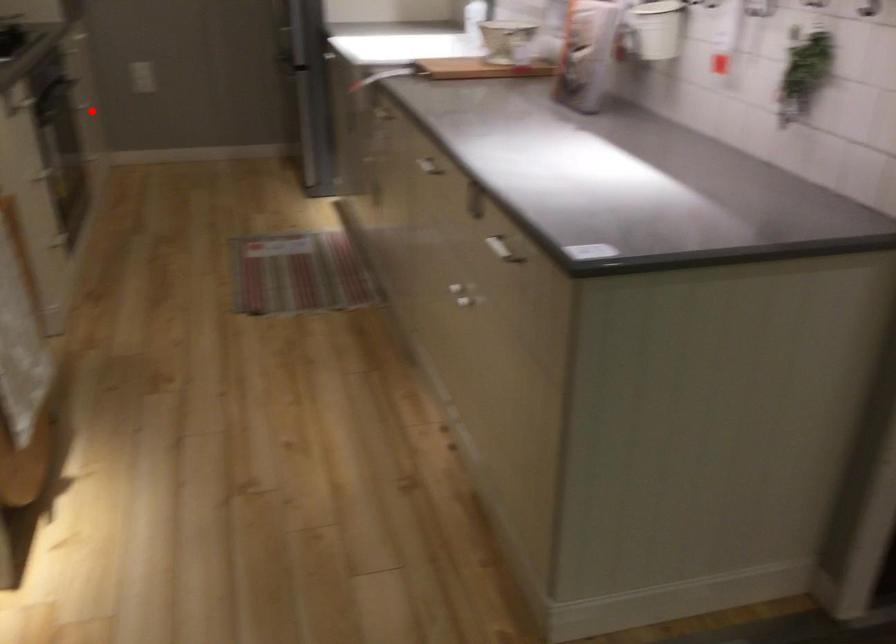
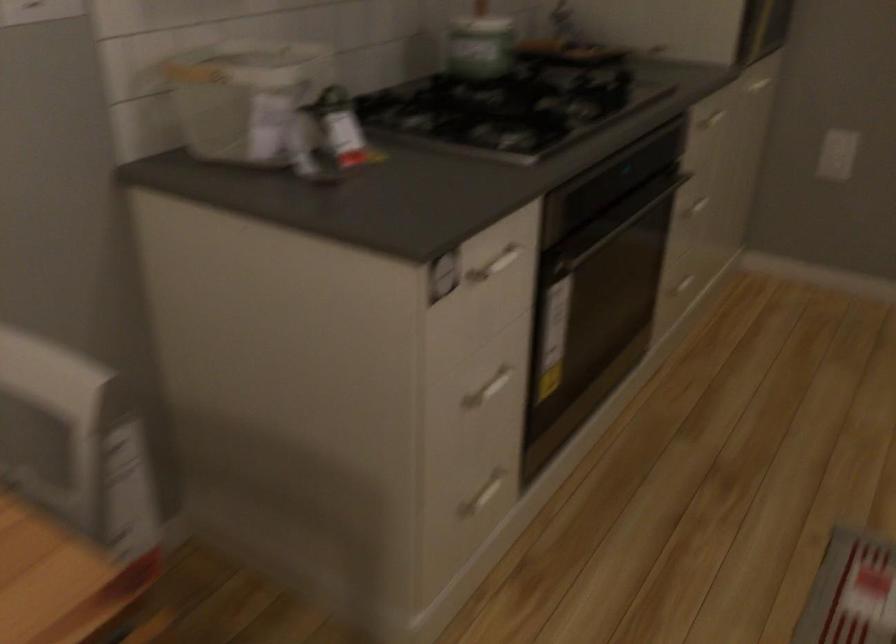
Find the pixel in the second image that matches the highlighted location in the first image.

(694, 204)